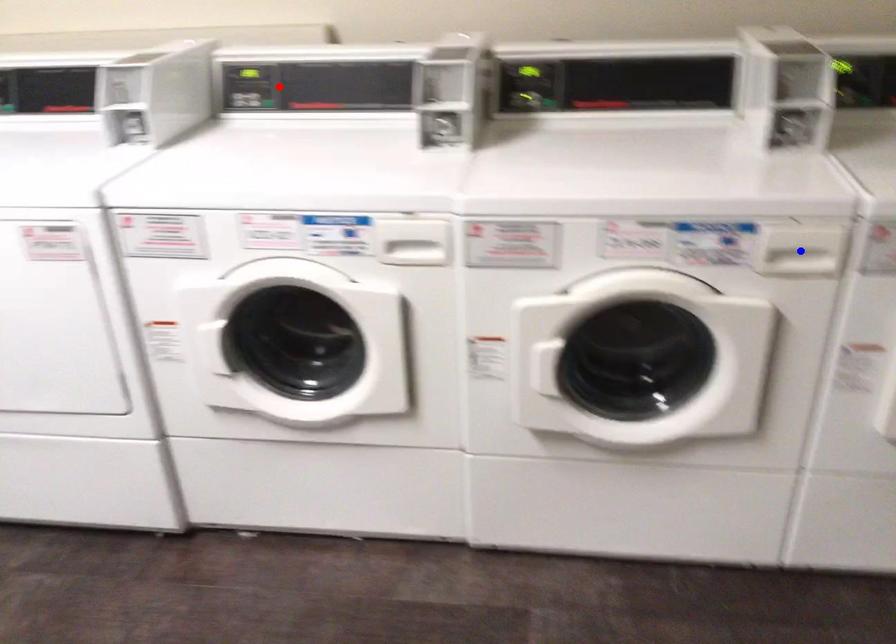
Question: Two points are marked on the image. Which point is closer to the camera?

Choices:
 (A) Blue point is closer.
 (B) Red point is closer.

Answer: (A)